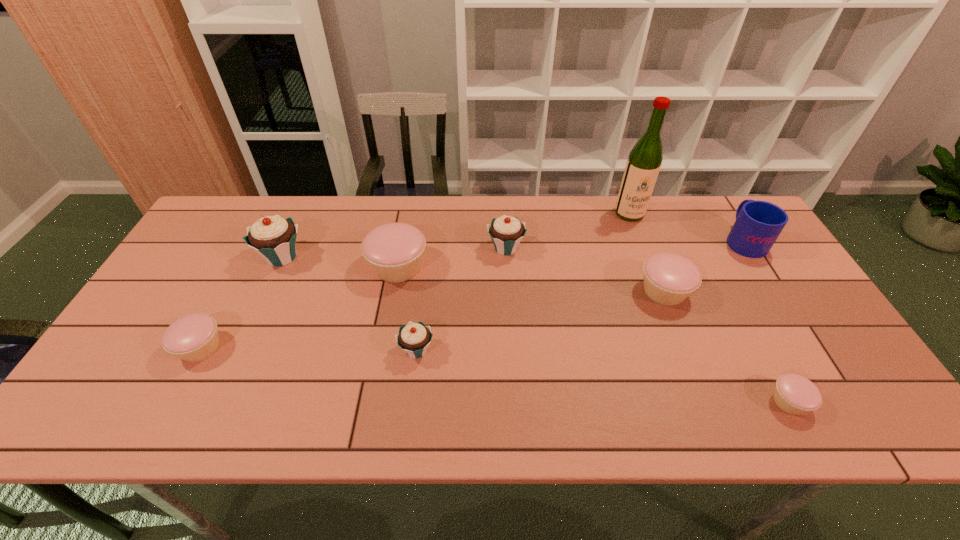
Locate an element on the screen. free space between the eighth object from left to right and the third smallest pink cupcake is located at coordinates (727, 346).

At what (x,y) coordinates should I click in order to perform the action: click on empty space between the tallest object and the third pink cupcake from left to right. Please return your answer as a coordinate pair (x, y). The width and height of the screenshot is (960, 540). Looking at the image, I should click on (647, 252).

Where is `free space between the tallest cupcake and the sixth cupcake from left to right`? free space between the tallest cupcake and the sixth cupcake from left to right is located at coordinates (473, 274).

Identify the location of free space between the blue mug and the green liquor. Image resolution: width=960 pixels, height=540 pixels. (686, 227).

The width and height of the screenshot is (960, 540). What are the coordinates of `free spot between the second smallest pink cupcake and the second teal cupcake from left to right` in the screenshot? It's located at (308, 349).

This screenshot has width=960, height=540. I want to click on free spot between the fifth cupcake from left to right and the smallest teal cupcake, so click(x=461, y=299).

Identify the location of free space between the leftmost pink cupcake and the tallest object. (415, 280).

You are a GUI agent. You are given a task and a screenshot of the screen. Output one action in this format:
    pyautogui.click(x=<x>, y=<y>)
    Task: Click on the unoccupied area between the mug and the liquor
    The width and height of the screenshot is (960, 540).
    Given the screenshot: What is the action you would take?
    pyautogui.click(x=686, y=227)

Find the location of `object that can be found as the third closest to the fifth object from left to right`. object that can be found as the third closest to the fifth object from left to right is located at coordinates [414, 338].

Point out which object is positioned as the second nearest to the third cupcake from right to left. Please provide its 2D coordinates. Your answer should be formatted as a tuple, i.e. [(x, y)], where the tuple contains the x and y coordinates of a point satisfying the conditions above.

[(669, 278)]